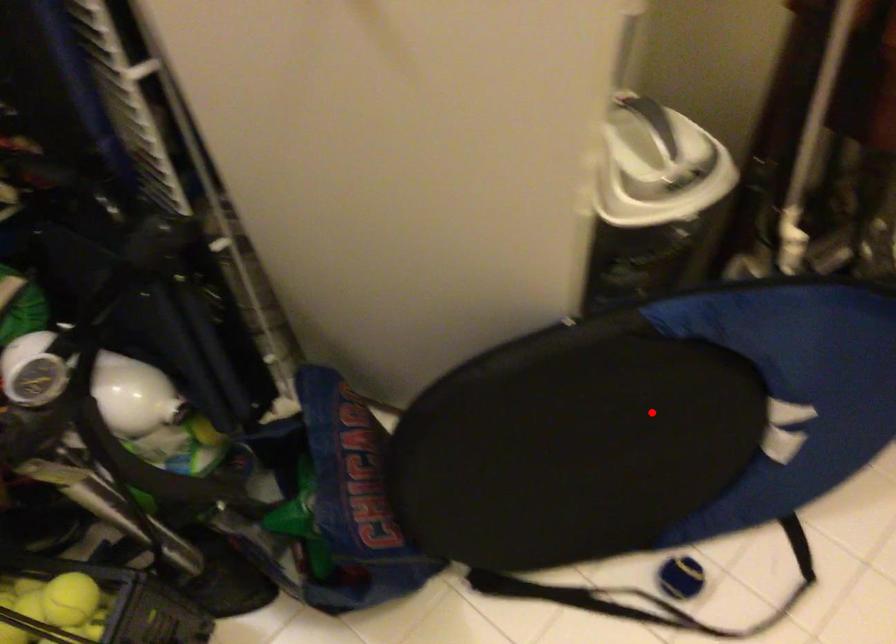
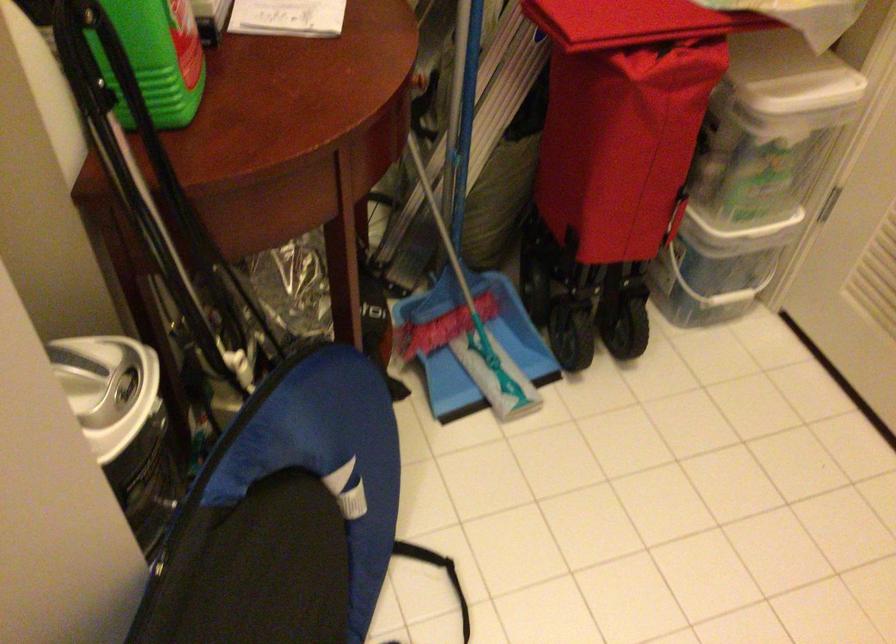
The point at the highlighted location is marked in the first image. Where is the corresponding point in the second image?

(271, 569)